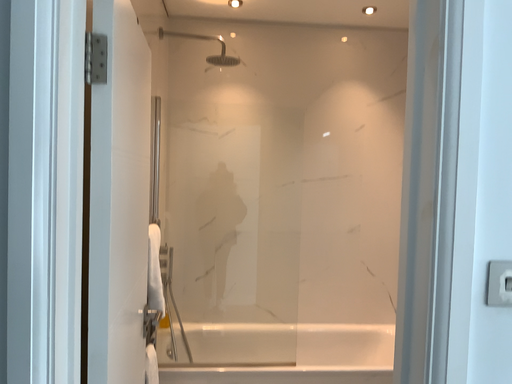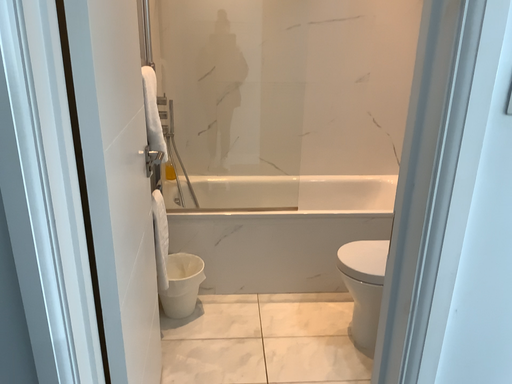
Question: How did the camera likely rotate when shooting the video?

Choices:
 (A) rotated downward
 (B) rotated upward

Answer: (A)